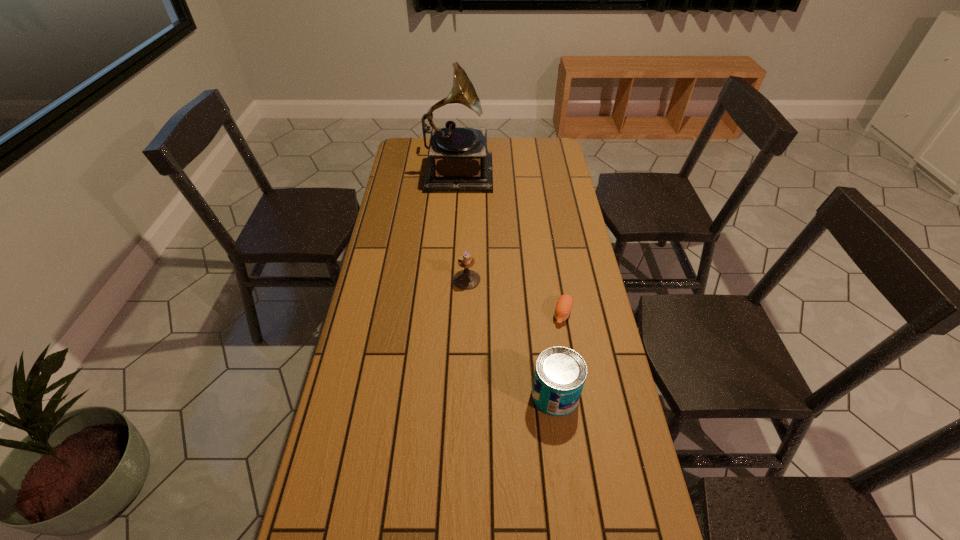
I want to click on free space that satisfies the following two spatial constraints: 1. on the horn of the record player; 2. on the left side of the second nearest object, so click(x=448, y=313).

The width and height of the screenshot is (960, 540). Find the location of `free space that satisfies the following two spatial constraints: 1. on the horn of the third farthest object; 2. on the left side of the tallest object`. free space that satisfies the following two spatial constraints: 1. on the horn of the third farthest object; 2. on the left side of the tallest object is located at coordinates click(448, 313).

This screenshot has width=960, height=540. I want to click on free space that satisfies the following two spatial constraints: 1. on the horn of the record player; 2. on the left side of the nearest object, so [x=444, y=395].

What are the coordinates of `vacant area in the image that satisfies the following two spatial constraints: 1. on the horn of the second nearest object; 2. on the right side of the record player` in the screenshot? It's located at (448, 313).

I want to click on vacant region that satisfies the following two spatial constraints: 1. on the horn of the record player; 2. on the right side of the sushi, so click(x=448, y=313).